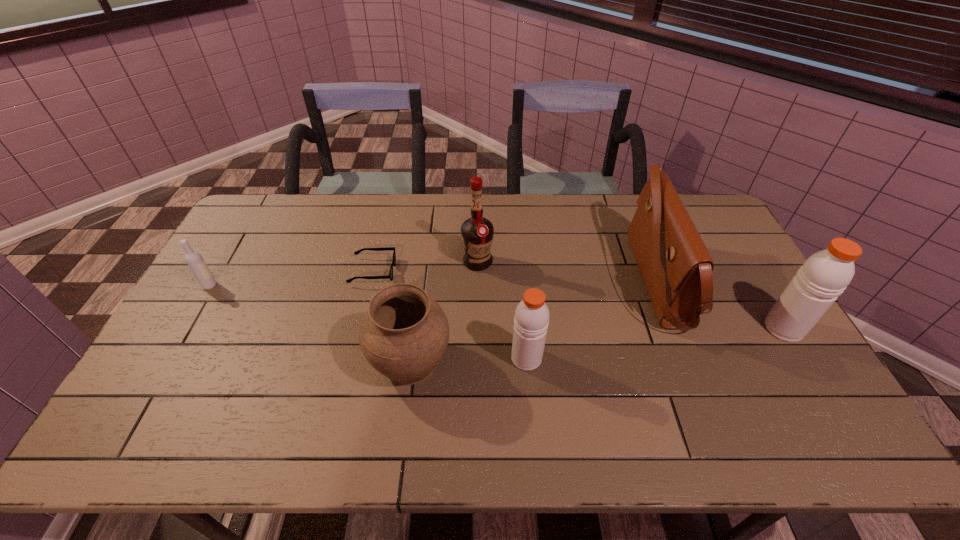
I want to click on free space located on the left of the left shaker, so click(x=403, y=358).

The width and height of the screenshot is (960, 540). I want to click on vacant area situated on the left of the rightmost object, so click(x=673, y=328).

Identify the location of free space located on the front and back of the fourth object from right to left. (477, 351).

At what (x,y) coordinates should I click in order to perform the action: click on vacant area situated 0.390m on the arms of the shortest object. Please return your answer as a coordinate pair (x, y). The width and height of the screenshot is (960, 540). Looking at the image, I should click on (516, 272).

I want to click on blank space located on the front flap of the sixth object from left to right, so click(x=524, y=282).

This screenshot has height=540, width=960. I want to click on free space located 0.340m on the front flap of the sixth object from left to right, so click(x=521, y=282).

I want to click on free region located 0.340m on the front flap of the sixth object from left to right, so click(521, 282).

Identify the location of free space located on the right of the urn. The width and height of the screenshot is (960, 540). (526, 361).

The width and height of the screenshot is (960, 540). What are the coordinates of `free spot located on the front of the leftmost object` in the screenshot? It's located at (187, 324).

The height and width of the screenshot is (540, 960). Find the location of `object located at the far edge`. object located at the far edge is located at coordinates (676, 267).